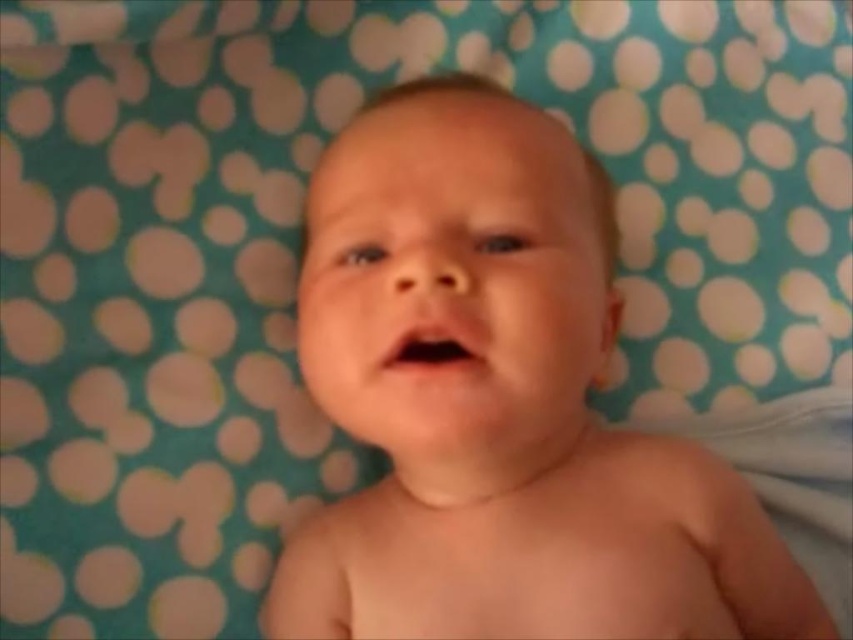
Who is taller, smooth skin baby at center or pink smooth mouth at center?

smooth skin baby at center

Who is positioned more to the left, smooth skin baby at center or pink smooth mouth at center?

pink smooth mouth at center

Is point (337, 340) less distant than point (451, 330)?

That is False.

Find the location of a particular element. This screenshot has width=853, height=640. smooth skin baby at center is located at coordinates (500, 404).